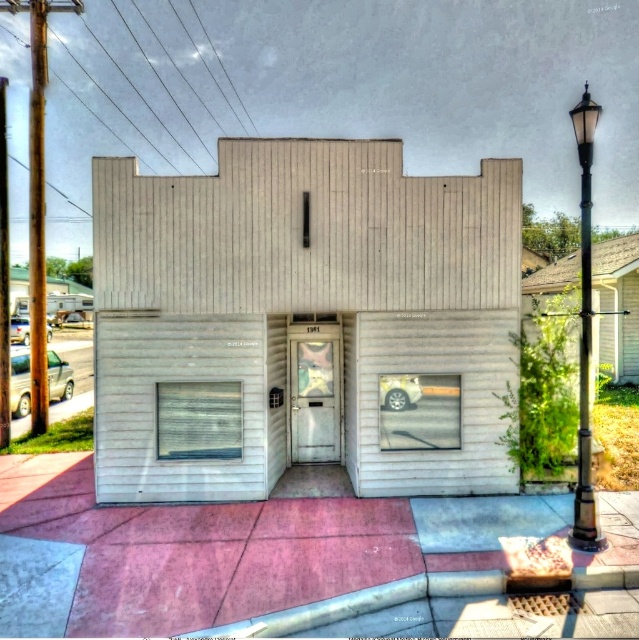
You are standing at the entrance of the small, single story building with a central door slightly off to the right. The building has white framed windows and a beige exterior. You need to locate the wooden utility pole at left. In which direction should you look relative to the building?

The wooden utility pole at left is located at point coordinates of (36, 216), so you should look to the left side of the building to find it.

You are standing on the sidewalk in front of the building and notice the wooden utility pole at left and the black polished metal streetlight at right. Which object is taller?

The wooden utility pole at left is taller than the black polished metal streetlight at right.